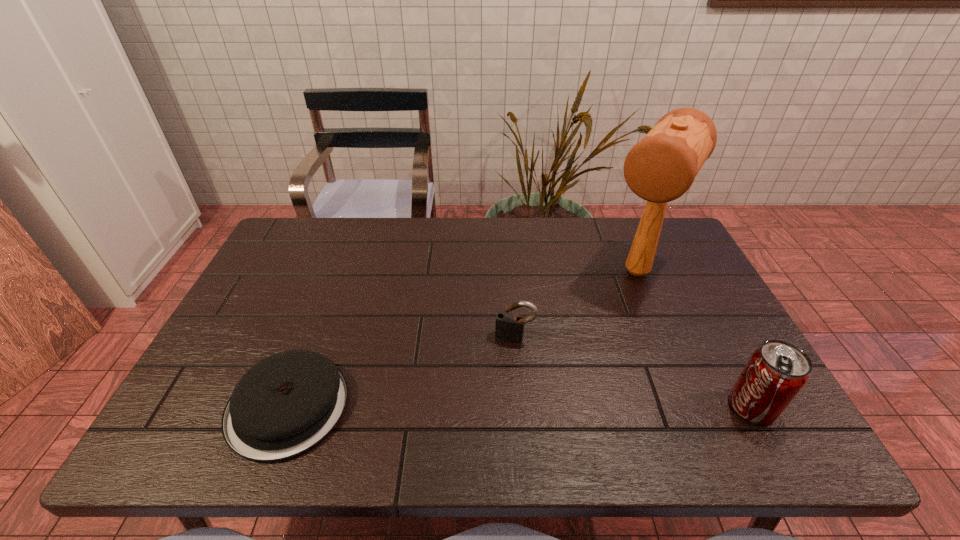
This screenshot has height=540, width=960. I want to click on the shortest object, so click(x=287, y=403).

I want to click on pancake, so click(x=287, y=403).

Identify the location of the second tallest object. (776, 372).

Where is `the farthest object`? the farthest object is located at coordinates (660, 168).

Find the location of a particular element. This screenshot has width=960, height=540. the tallest object is located at coordinates (660, 168).

Find the location of `the third tallest object`. the third tallest object is located at coordinates (510, 327).

Image resolution: width=960 pixels, height=540 pixels. I want to click on padlock, so pyautogui.click(x=510, y=327).

Locate an element on the screen. This screenshot has height=540, width=960. free space located on the back of the leftmost object is located at coordinates (311, 343).

Locate an element on the screen. The image size is (960, 540). free space located on the left of the pop soda is located at coordinates (639, 407).

You are a GUI agent. You are given a task and a screenshot of the screen. Output one action in this format:
    pyautogui.click(x=<x>, y=<y>)
    Task: Click on the free point located on the strike surface of the mallet
    This screenshot has height=540, width=960.
    Given the screenshot: What is the action you would take?
    pyautogui.click(x=593, y=343)